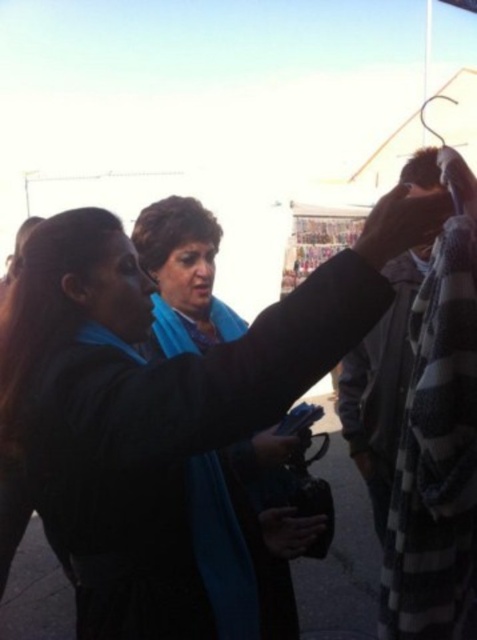
Question: Is matte black jacket at upper center further to the viewer compared to blue fabric scarf at center?

Choices:
 (A) yes
 (B) no

Answer: (B)

Question: Is matte black jacket at upper center positioned at the back of blue fabric scarf at center?

Choices:
 (A) no
 (B) yes

Answer: (A)

Question: Does matte black jacket at upper center have a greater width compared to blue fabric scarf at center?

Choices:
 (A) no
 (B) yes

Answer: (B)

Question: Which object appears farthest from the camera in this image?

Choices:
 (A) blue fabric scarf at center
 (B) matte black jacket at upper center

Answer: (A)